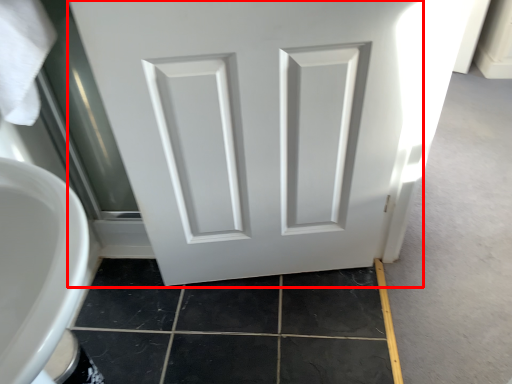
Question: Considering the relative positions of door (annotated by the red box) and tile in the image provided, where is door (annotated by the red box) located with respect to the staircase?

Choices:
 (A) left
 (B) right

Answer: (B)